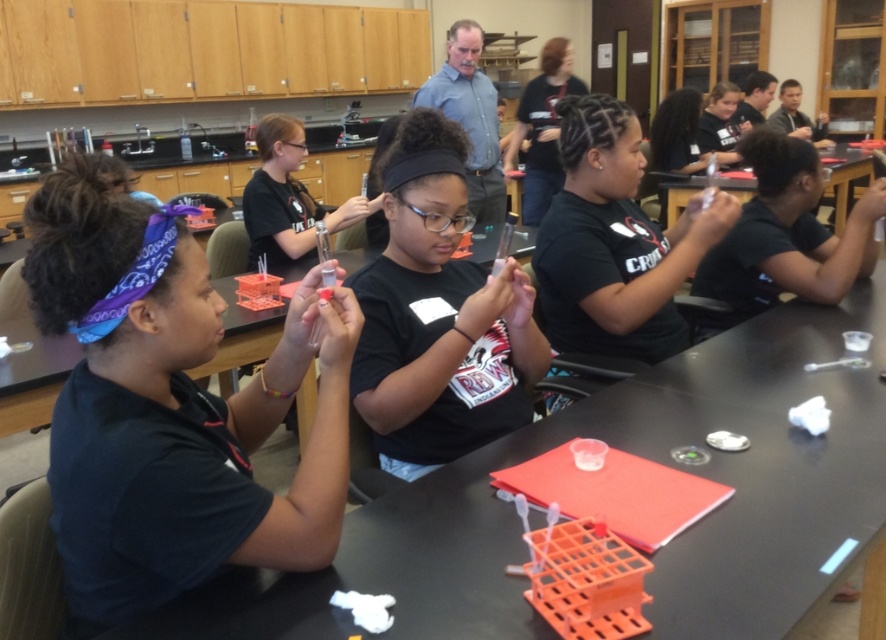
Is point (504, 374) closer to viewer compared to point (868, 177)?

Yes.

Is black matte shirt at center smaller than black plastic table at center?

Yes.

Find the location of a particular element. The height and width of the screenshot is (640, 886). black matte shirt at center is located at coordinates (438, 316).

This screenshot has height=640, width=886. Identify the location of black matte shirt at center. (438, 316).